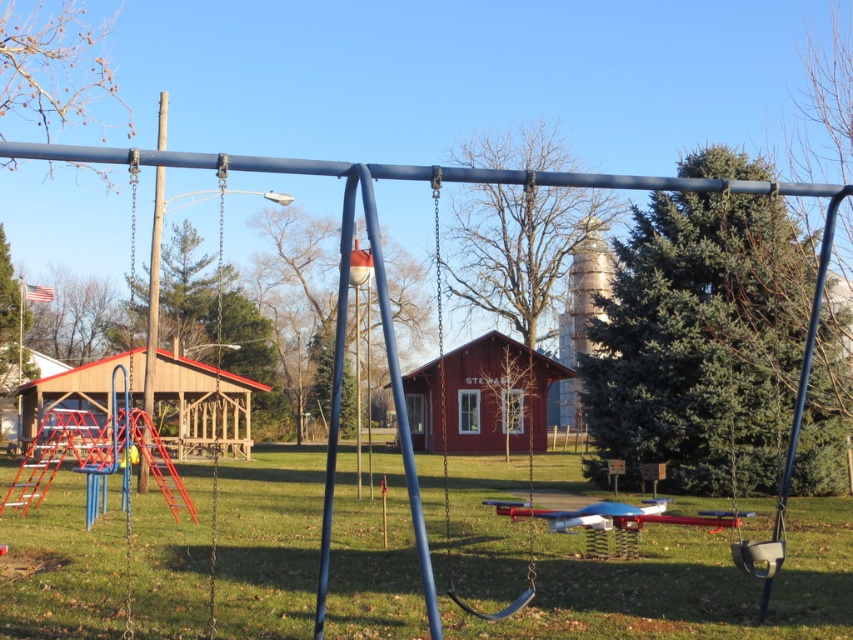
You are a child trying to reach the metallic swing at center from the green grass at center. Which direction should you move to get closer to the swing?

You should move forward because the green grass at center is closer to you than the metallic swing at center, so moving towards the swing would require going forward.

You are a parent trying to set up a picnic blanket for your children. The picnic blanket is 2 meters wide. You have a choice between placing it on the green grass at center or near the metallic swing at center. Based on the available space, which location would allow the blanket to fit without overlapping the edges?

The green grass at center has a larger width than the metallic swing at center. Since the picnic blanket is 2 meters wide, placing it on the green grass at center would provide enough space to fit without overlapping the edges.